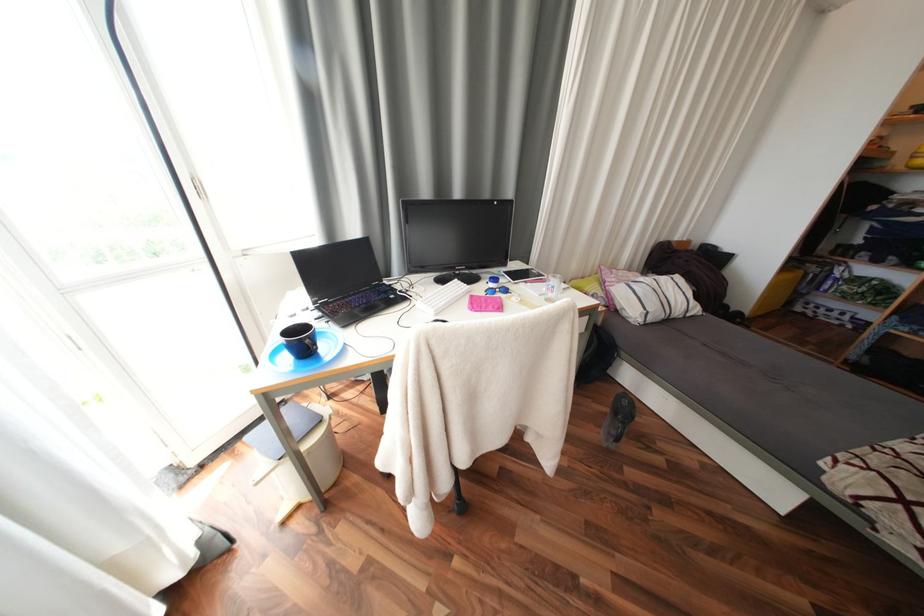
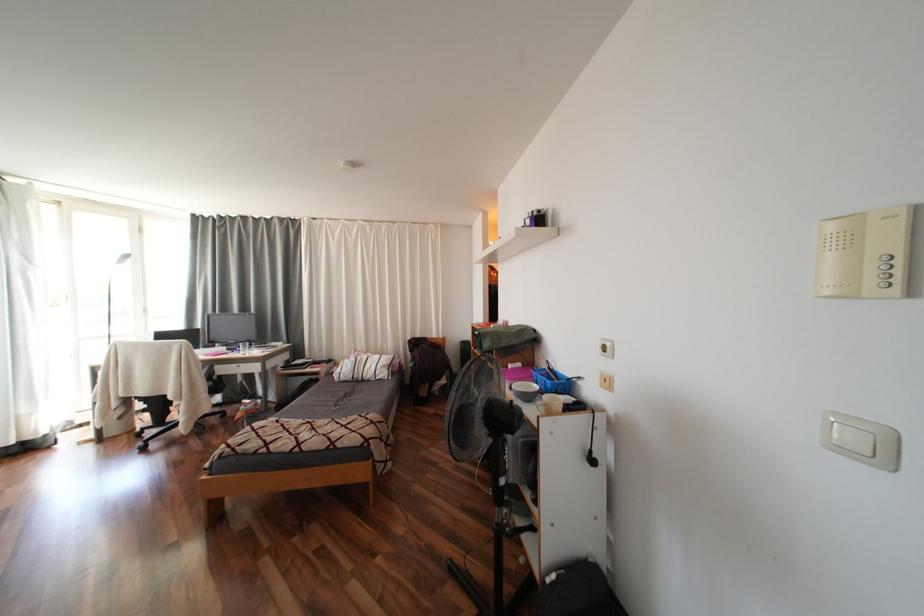
Question: Which direction would the cameraman need to move to produce the second image? Reply with the corresponding letter.

Choices:
 (A) Left
 (B) Right
 (C) Forward
 (D) Backward

Answer: (B)